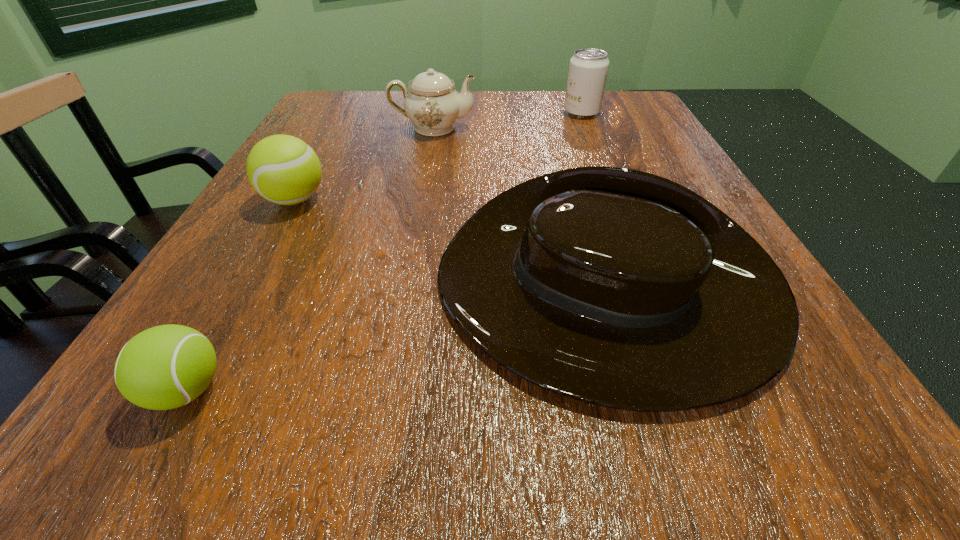
The image size is (960, 540). What are the coordinates of `vacant region at the far edge` in the screenshot? It's located at (586, 130).

In the image, there is a desktop. At what (x,y) coordinates should I click in order to perform the action: click on vacant space at the near edge. Please return your answer as a coordinate pair (x, y). The height and width of the screenshot is (540, 960). Looking at the image, I should click on (343, 449).

In the image, there is a desktop. Where is `vacant region at the left edge`? The height and width of the screenshot is (540, 960). vacant region at the left edge is located at coordinates (226, 367).

Identify the location of free space at the right edge of the desktop. This screenshot has width=960, height=540. (805, 351).

Find the location of `vacant area at the far left corner`. vacant area at the far left corner is located at coordinates (311, 130).

The width and height of the screenshot is (960, 540). I want to click on vacant space at the near left corner of the desktop, so click(x=109, y=447).

In the image, there is a desktop. Where is `vacant space at the far right corner`? The image size is (960, 540). vacant space at the far right corner is located at coordinates (607, 114).

Image resolution: width=960 pixels, height=540 pixels. What are the coordinates of `vacant point located between the chinaware and the shortest object` in the screenshot? It's located at (309, 259).

Where is `free space that is in between the farther tennis ball and the soda can`? This screenshot has height=540, width=960. free space that is in between the farther tennis ball and the soda can is located at coordinates (439, 156).

This screenshot has height=540, width=960. What are the coordinates of `free space between the soda can and the taller tennis ball` in the screenshot? It's located at pyautogui.click(x=439, y=156).